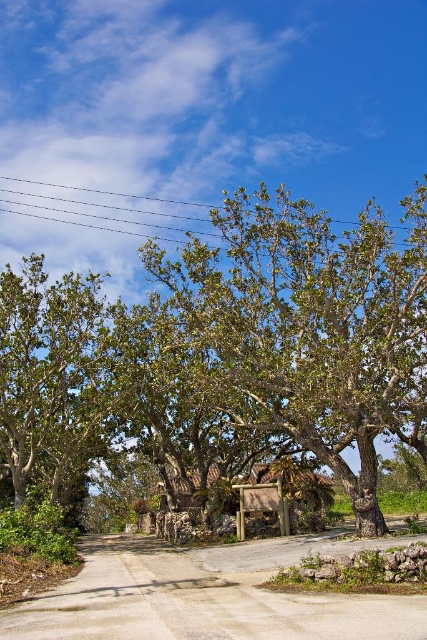
Question: Which of the following is the farthest from the observer?

Choices:
 (A) (245, 195)
 (B) (35, 204)
 (C) (15, 333)

Answer: (B)

Question: Where is green leafy tree at center located in relation to green leafy tree at left in the image?

Choices:
 (A) above
 (B) below

Answer: (A)

Question: Which object is farther from the camera taking this photo?

Choices:
 (A) green leafy tree at center
 (B) green leafy tree at left

Answer: (B)

Question: Estimate the real-world distances between objects in this image. Which object is closer to the black wire at upper center?

Choices:
 (A) green leafy tree at center
 (B) green leafy tree at left

Answer: (A)

Question: Is green leafy tree at left above black wire at upper center?

Choices:
 (A) yes
 (B) no

Answer: (B)

Question: Is green leafy tree at center in front of black wire at upper center?

Choices:
 (A) no
 (B) yes

Answer: (B)